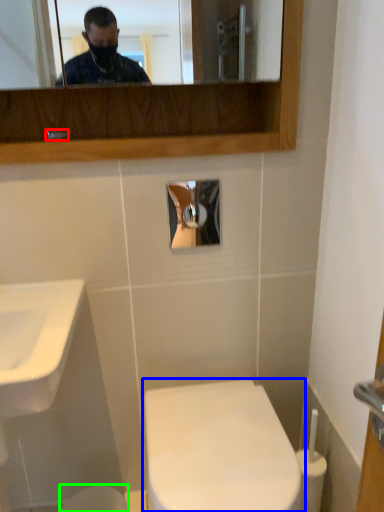
Question: Which object is positioned closest to faucet (highlighted by a red box)? Select from toilet (highlighted by a blue box) and toilet bowl (highlighted by a green box).

Choices:
 (A) toilet
 (B) toilet bowl

Answer: (A)